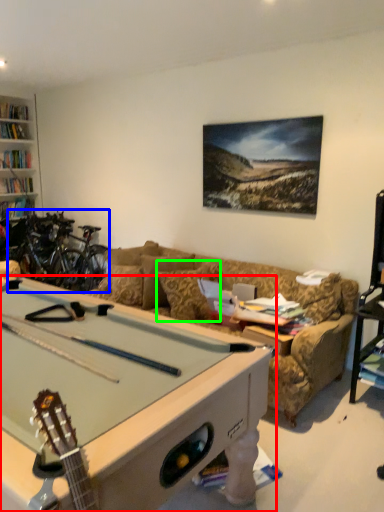
Question: Based on their relative distances, which object is farther from billiard table (highlighted by a red box)? Choose from bicycle (highlighted by a blue box) and pillow (highlighted by a green box).

Choices:
 (A) bicycle
 (B) pillow

Answer: (A)